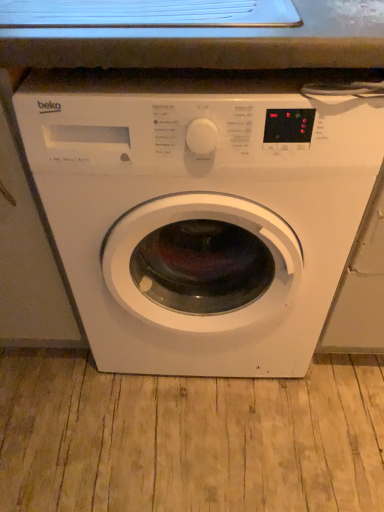
What do you see at coordinates (200, 210) in the screenshot? This screenshot has width=384, height=512. I see `white matte washing machine at center` at bounding box center [200, 210].

The image size is (384, 512). What are the coordinates of `white matte washing machine at center` in the screenshot? It's located at (200, 210).

At what (x,y) coordinates should I click in order to perform the action: click on white matte washing machine at center. Please return your answer as a coordinate pair (x, y). Looking at the image, I should click on pyautogui.click(x=200, y=210).